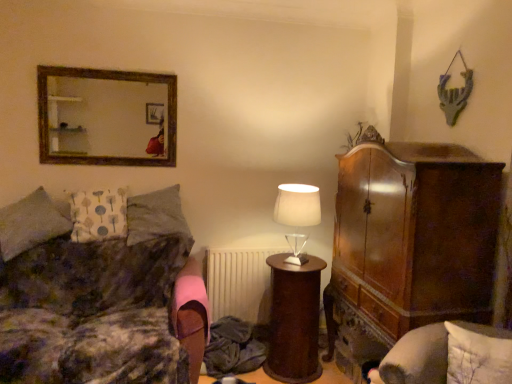
Locate an element on the screen. vacant space underneath white matte table lamp at center (from a real-world perspective) is located at coordinates (293, 260).